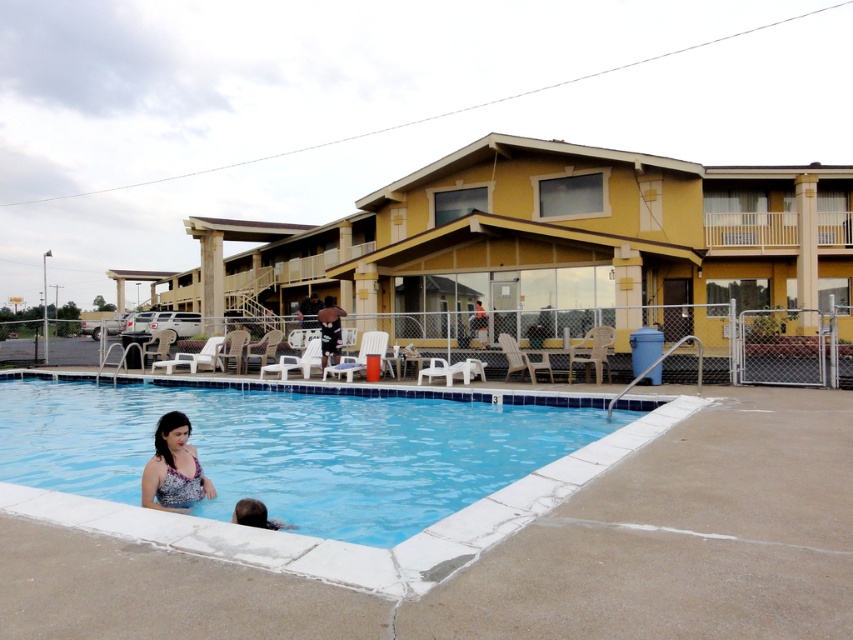
You are standing at the poolside and want to locate two specific points marked in the image. The first point is at coordinates point (422, 445) and the second is at point (144, 483). Based on the scene, which point is closer to the building?

Point (144, 483) is closer to the building because it is in front of point (422, 445), which is behind it.

What are the coordinates of the matte floral swimsuit at lower left?

The coordinates of the matte floral swimsuit at lower left are at point (x=173, y=467).

You are a lifeguard standing on the pool deck and you see the blue tile swimming pool at lower left and the brown hair at lower left. Which object is taller?

The blue tile swimming pool at lower left is taller than the brown hair at lower left according to the description.